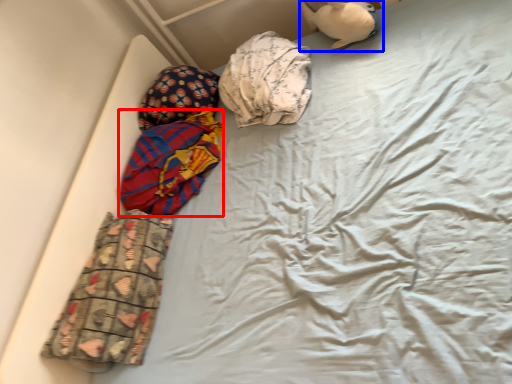
Question: Which object appears farthest to the camera in this image, material (highlighted by a red box) or toy (highlighted by a blue box)?

Choices:
 (A) material
 (B) toy

Answer: (B)